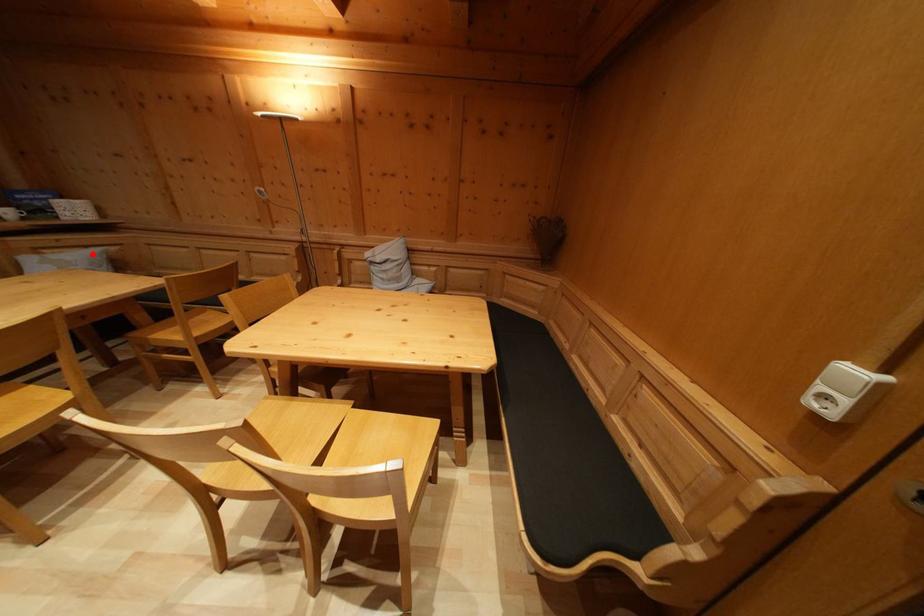
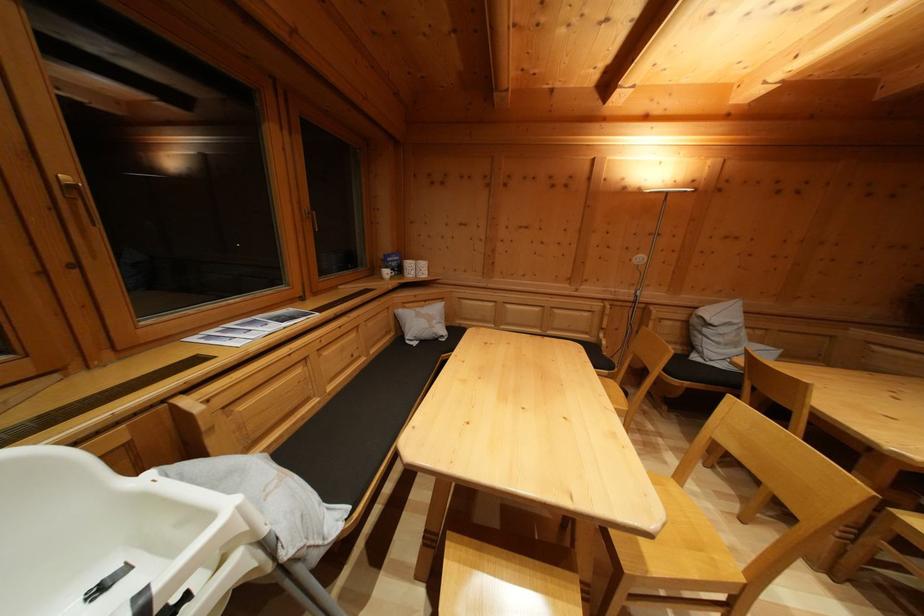
Question: I am providing you with two images of the same scene from different viewpoints. A red point is marked on the first image. Is the red point's position out of view in image 2?

Choices:
 (A) Yes
 (B) No

Answer: (B)